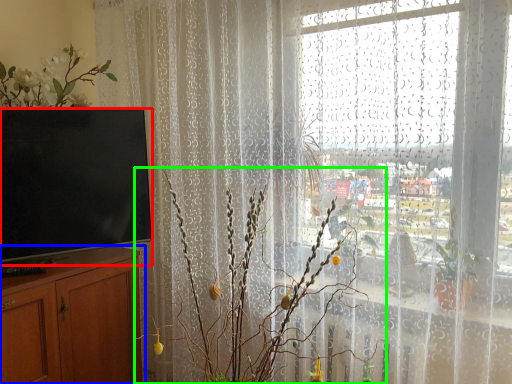
Question: Estimate the real-world distances between objects in this image. Which object is closer to television (highlighted by a red box), cabinetry (highlighted by a blue box) or floral arrangement (highlighted by a green box)?

Choices:
 (A) cabinetry
 (B) floral arrangement

Answer: (A)